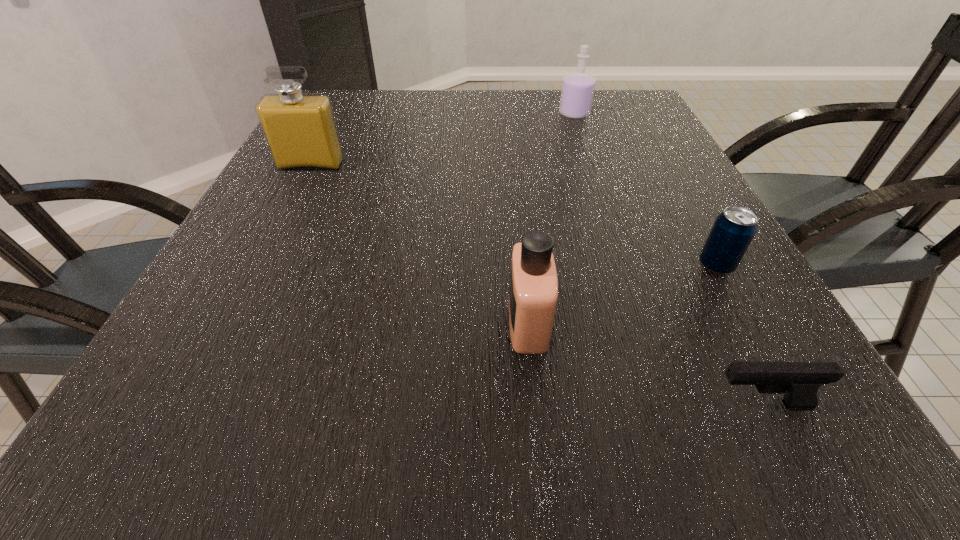
This screenshot has height=540, width=960. I want to click on free space located 0.320m on the front-facing side of the tallest perfume, so click(255, 274).

Find the location of a particular element. The width and height of the screenshot is (960, 540). free space located 0.060m on the right of the farthest object is located at coordinates (612, 114).

I want to click on vacant space located 0.310m on the front label of the fourth object from right to left, so click(306, 322).

At what (x,y) coordinates should I click in order to perform the action: click on vacant space positioned on the front label of the fourth object from right to left. Please return your answer as a coordinate pair (x, y). The image size is (960, 540). Looking at the image, I should click on (437, 322).

This screenshot has width=960, height=540. Find the location of `vacant space located on the front label of the fourth object from right to left`. vacant space located on the front label of the fourth object from right to left is located at coordinates (411, 322).

Locate an element on the screen. This screenshot has width=960, height=540. free space located on the back of the fourth tallest object is located at coordinates (662, 167).

You are a GUI agent. You are given a task and a screenshot of the screen. Output one action in this format:
    pyautogui.click(x=<x>, y=<y>)
    Task: Click on the free space located 0.150m on the front-facing side of the pistol
    
    Given the screenshot: What is the action you would take?
    590,406

Identify the location of free space located 0.090m on the front-facing side of the pistol. (636, 406).

Find the location of a particular element. The width and height of the screenshot is (960, 540). free space located 0.290m on the front-facing side of the pistol is located at coordinates (483, 406).

Find the location of a particular element. object present at the far edge is located at coordinates (578, 87).